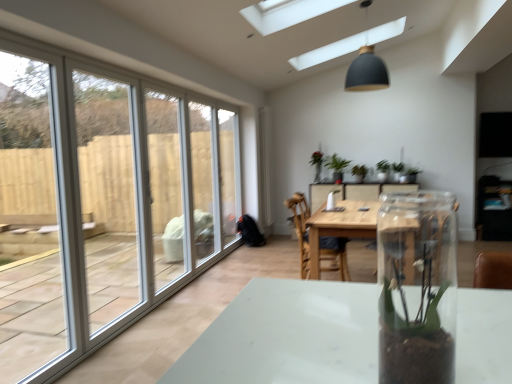
Question: From a real-world perspective, is wooden table at center under green matte plant at center, arranged as the second houseplant when viewed from the right?

Choices:
 (A) no
 (B) yes

Answer: (B)

Question: Is wooden table at center with green matte plant at center, which appears as the first houseplant when viewed from the left?

Choices:
 (A) no
 (B) yes

Answer: (A)

Question: From the image's perspective, would you say wooden table at center is shown under green matte plant at center, which appears as the first houseplant when viewed from the left?

Choices:
 (A) yes
 (B) no

Answer: (A)

Question: Is wooden table at center thinner than green matte plant at center, arranged as the second houseplant when viewed from the right?

Choices:
 (A) yes
 (B) no

Answer: (B)

Question: Can you confirm if wooden table at center is taller than green matte plant at center, arranged as the second houseplant when viewed from the right?

Choices:
 (A) no
 (B) yes

Answer: (B)

Question: Is green matte plant at center, arranged as the second houseplant when viewed from the right, situated inside clear glass vase at center or outside?

Choices:
 (A) inside
 (B) outside

Answer: (B)

Question: Considering the positions of point [x=338, y=167] and point [x=393, y=261], is point [x=338, y=167] closer or farther from the camera than point [x=393, y=261]?

Choices:
 (A) farther
 (B) closer

Answer: (A)

Question: From the image's perspective, is green matte plant at center, which appears as the first houseplant when viewed from the left, positioned above or below clear glass vase at center?

Choices:
 (A) above
 (B) below

Answer: (A)

Question: In terms of width, does green matte plant at center, arranged as the second houseplant when viewed from the right, look wider or thinner when compared to clear glass vase at center?

Choices:
 (A) wide
 (B) thin

Answer: (A)

Question: Considering the positions of wooden chair at center and clear glass vase at center in the image, is wooden chair at center bigger or smaller than clear glass vase at center?

Choices:
 (A) big
 (B) small

Answer: (A)

Question: Is wooden chair at center wider or thinner than clear glass vase at center?

Choices:
 (A) thin
 (B) wide

Answer: (B)

Question: From the image's perspective, is wooden chair at center above or below clear glass vase at center?

Choices:
 (A) above
 (B) below

Answer: (B)

Question: Is point (327, 248) closer or farther from the camera than point (413, 319)?

Choices:
 (A) farther
 (B) closer

Answer: (A)

Question: Based on their positions, is wooden table at center located to the left or right of clear glass vase at center?

Choices:
 (A) left
 (B) right

Answer: (B)

Question: From the image's perspective, is wooden table at center above or below clear glass vase at center?

Choices:
 (A) above
 (B) below

Answer: (B)